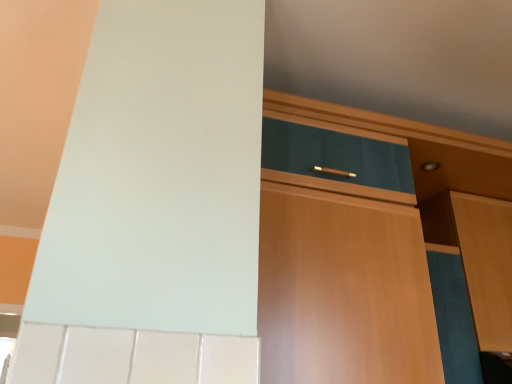
Question: In terms of width, does wooden cabinet at right, arranged as the second cabinetry when viewed from the left, look wider or thinner when compared to wooden cabinet at center, the first cabinetry from the left?

Choices:
 (A) thin
 (B) wide

Answer: (A)

Question: Is wooden cabinet at right, placed as the 1th cabinetry when sorted from right to left, to the left or to the right of wooden cabinet at center, the second cabinetry viewed from the right, in the image?

Choices:
 (A) left
 (B) right

Answer: (B)

Question: In the image, is wooden cabinet at right, arranged as the second cabinetry when viewed from the left, positioned in front of or behind wooden cabinet at center, the first cabinetry from the left?

Choices:
 (A) front
 (B) behind

Answer: (B)

Question: Would you say wooden cabinet at center, the first cabinetry from the left, is inside or outside wooden cabinet at right, placed as the 1th cabinetry when sorted from right to left?

Choices:
 (A) inside
 (B) outside

Answer: (B)

Question: Looking at their shapes, would you say wooden cabinet at center, the second cabinetry viewed from the right, is wider or thinner than wooden cabinet at right, arranged as the second cabinetry when viewed from the left?

Choices:
 (A) thin
 (B) wide

Answer: (B)

Question: Relative to wooden cabinet at right, arranged as the second cabinetry when viewed from the left, is wooden cabinet at center, the first cabinetry from the left, in front or behind?

Choices:
 (A) front
 (B) behind

Answer: (A)

Question: Does point (293, 105) appear closer or farther from the camera than point (486, 233)?

Choices:
 (A) farther
 (B) closer

Answer: (B)